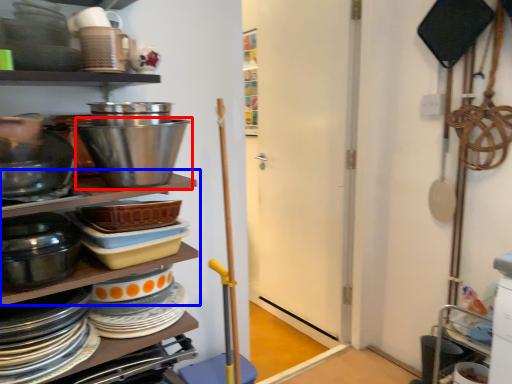
Question: Which of the following is the closest to the observer, bowl (highlighted by a red box) or shelf (highlighted by a blue box)?

Choices:
 (A) bowl
 (B) shelf

Answer: (B)